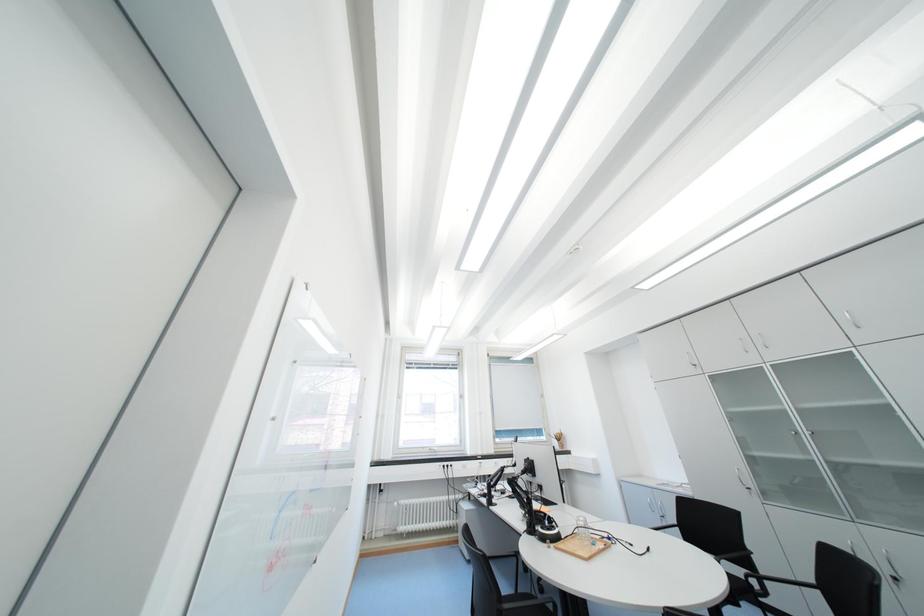
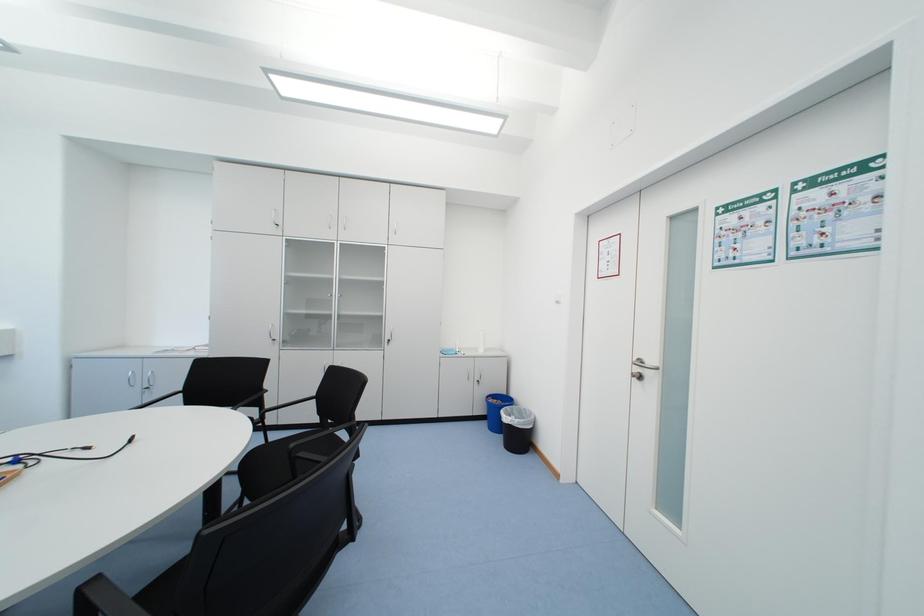
Question: Based on the continuous images, in which direction is the camera rotating? Reply with the corresponding letter.

Choices:
 (A) Left
 (B) Right
 (C) Up
 (D) Down

Answer: (B)